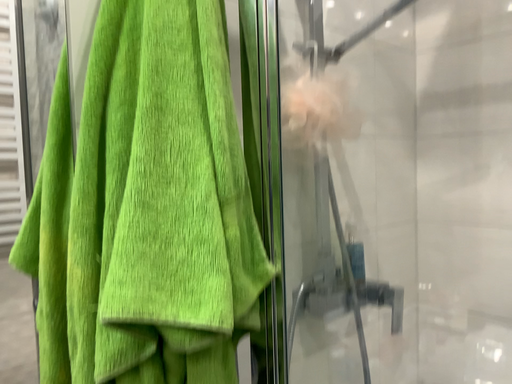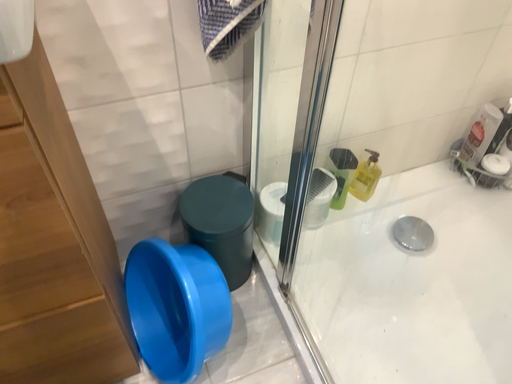
Question: How did the camera likely rotate when shooting the video?

Choices:
 (A) rotated right
 (B) rotated left

Answer: (B)